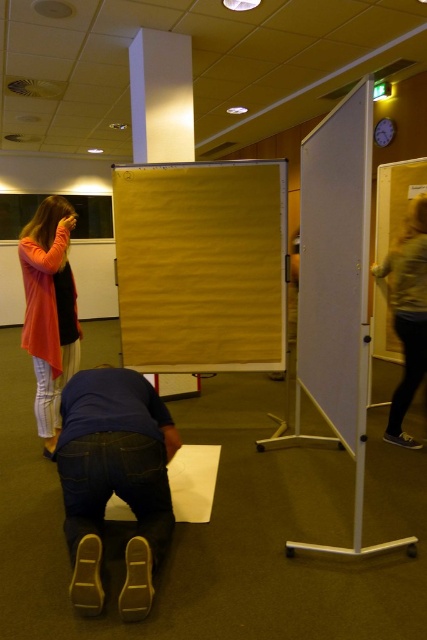
What do you see at coordinates (114, 481) in the screenshot? I see `dark blue jeans at lower center` at bounding box center [114, 481].

Is point (72, 513) positioned before point (392, 321)?

Yes, point (72, 513) is in front of point (392, 321).

Locate an element on the screen. This screenshot has width=427, height=640. dark blue jeans at lower center is located at coordinates (114, 481).

Which of these two, matte orange cardigan at left or light brown leather jacket at right, stands taller?

Standing taller between the two is matte orange cardigan at left.

Who is shorter, matte orange cardigan at left or light brown leather jacket at right?

With less height is light brown leather jacket at right.

Describe the element at coordinates (49, 310) in the screenshot. I see `matte orange cardigan at left` at that location.

At what (x,y) coordinates should I click in order to perform the action: click on matte orange cardigan at left. Please return your answer as a coordinate pair (x, y). The width and height of the screenshot is (427, 640). Looking at the image, I should click on click(49, 310).

Can you confirm if dark blue jeans at lower center is shorter than matte orange cardigan at left?

Indeed, dark blue jeans at lower center has a lesser height compared to matte orange cardigan at left.

Find the location of a particular element. The width and height of the screenshot is (427, 640). dark blue jeans at lower center is located at coordinates (114, 481).

This screenshot has height=640, width=427. I want to click on dark blue jeans at lower center, so click(x=114, y=481).

Where is `dark blue jeans at lower center`? Image resolution: width=427 pixels, height=640 pixels. dark blue jeans at lower center is located at coordinates 114,481.